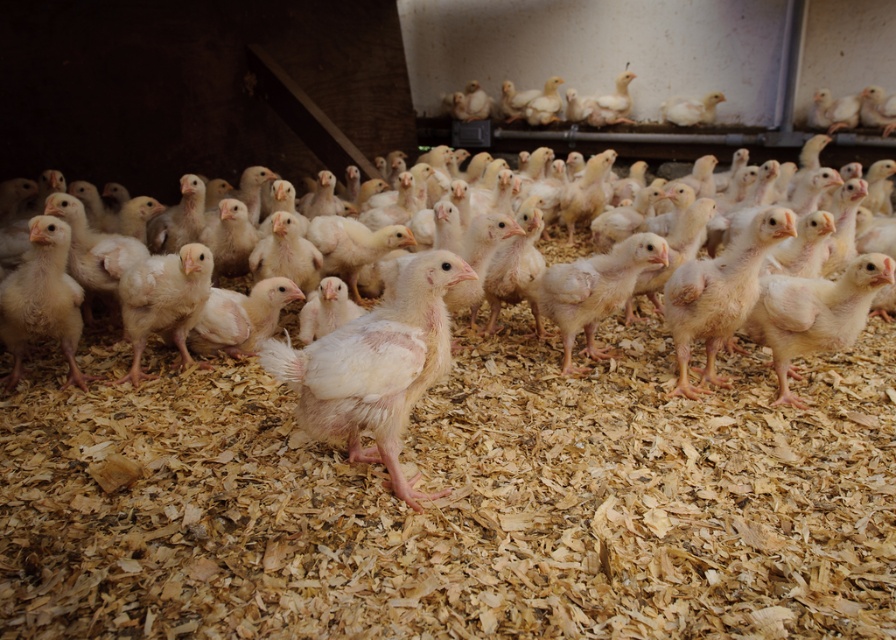
You are a farmer checking on the chicks in the barn. You notice two points marked on the floor where the chicks are most active. The first point is at coordinates point (x=578, y=452) and the second is at point (x=341, y=364). If you walk from the entrance towards the back of the barn, which point will you encounter first?

Point (x=341, y=364) will be encountered first because it is in front of point (x=578, y=452), which is further back in the barn.

You are a farmer checking the chicks in the barn. You notice the white fluffy chicken at center and the white fluffy chick at center. Which one has a larger body size?

The white fluffy chicken at center is wider than the white fluffy chick at center, so it has a larger body size.